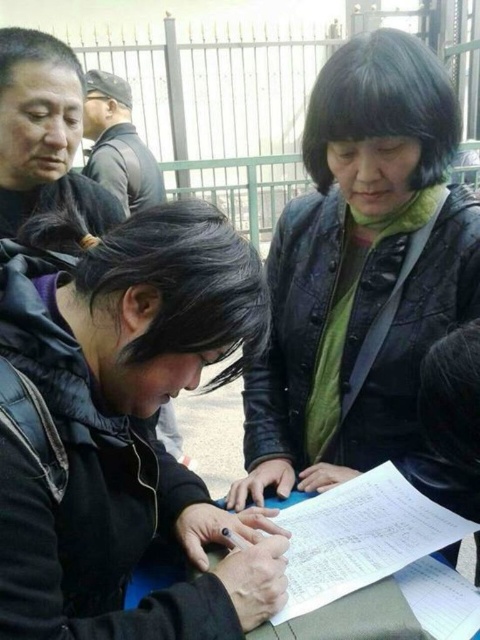
You are organizing a small outdoor meeting and need to place a name tag on the table. The name tag is the size of the white paper at center. Can you fit it next to the black leather jacket at lower left without overlapping?

The black leather jacket at lower left has a larger size compared to the white paper at center. Since the jacket is bigger, there should be enough space to place the name tag next to it without overlapping.

You are taking a photo of the group around the table. You want to focus on the person at point (8, 628) and the person at point (360, 524). Which point should you focus on first to ensure both are in focus?

You should focus on point (8, 628) first because it is closer to the camera than point (360, 524). This ensures the closer subject is in focus, and the farther one will also be within the depth of field.